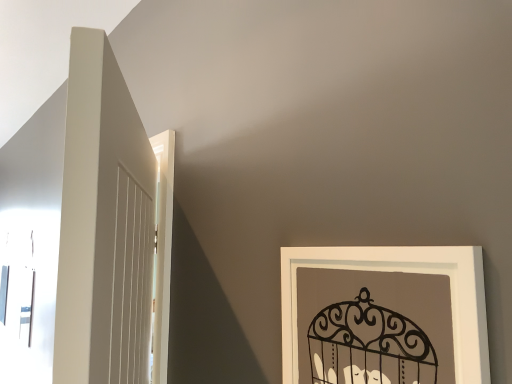
Locate an element on the screen. This screenshot has width=512, height=384. white matte picture frame at lower right is located at coordinates (406, 272).

Describe the element at coordinates (406, 272) in the screenshot. I see `white matte picture frame at lower right` at that location.

What are the coordinates of `white matte picture frame at lower right` in the screenshot? It's located at (406, 272).